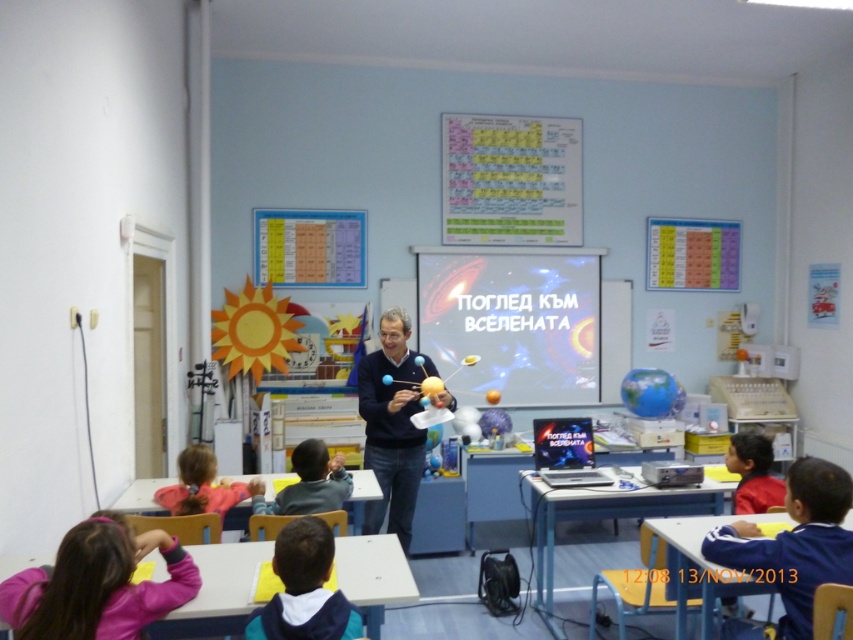
Is pink fabric hairband at lower left to the left of matte black sweater at center from the viewer's perspective?

Indeed, pink fabric hairband at lower left is positioned on the left side of matte black sweater at center.

Locate an element on the screen. pink fabric hairband at lower left is located at coordinates (97, 584).

Who is lower down, matte black sweater at center or pink fabric shirt at lower left?

pink fabric shirt at lower left

From the picture: Does matte black sweater at center have a larger size compared to pink fabric shirt at lower left?

Yes, matte black sweater at center is bigger than pink fabric shirt at lower left.

Between point (374, 381) and point (194, 468), which one is positioned behind?

The point (374, 381) is behind.

Locate an element on the screen. This screenshot has height=640, width=853. matte black sweater at center is located at coordinates (392, 426).

Which is in front, point (303, 493) or point (741, 445)?

Positioned in front is point (303, 493).

Between blue sweater at lower center and red matte shirt at lower right, which one has less height?

blue sweater at lower center is shorter.

At what (x,y) coordinates should I click in order to perform the action: click on blue sweater at lower center. Please return your answer as a coordinate pair (x, y). This screenshot has width=853, height=640. Looking at the image, I should click on (306, 483).

Find the location of a particular element. blue sweater at lower center is located at coordinates (306, 483).